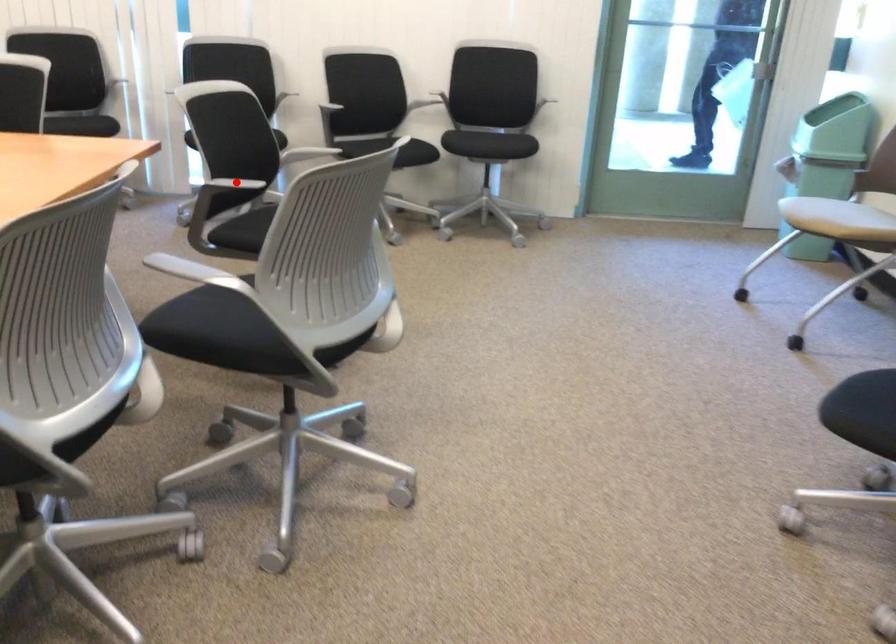
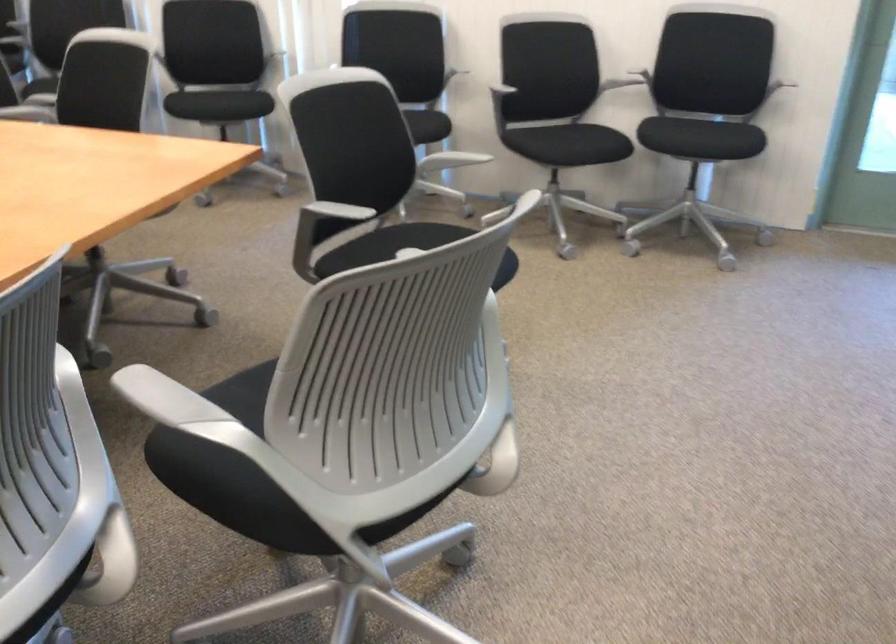
Question: I am providing you with two images of the same scene from different viewpoints. Image1 has a red point marked. In image2, the corresponding 3D location appears at what relative position? Reply with the corresponding letter.

Choices:
 (A) Closer
 (B) Farther

Answer: (A)